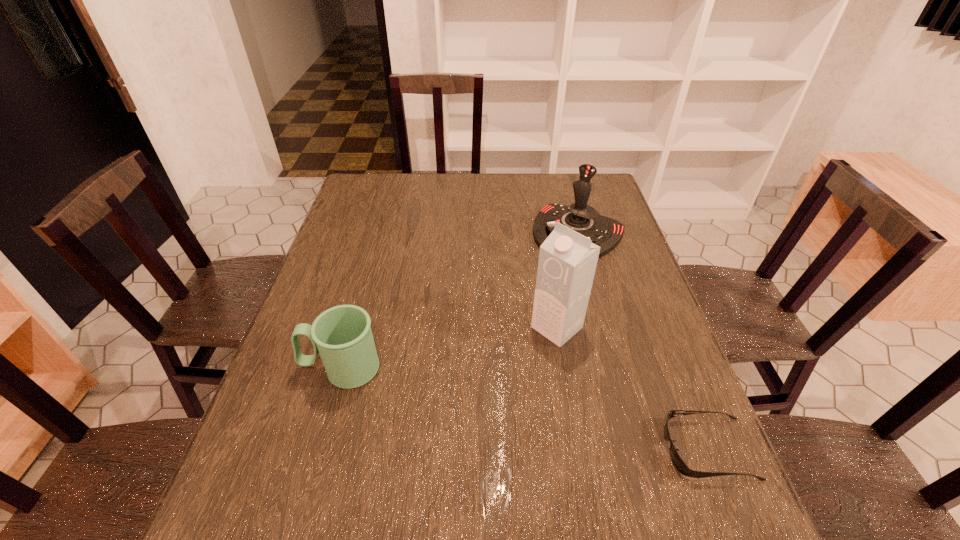
The width and height of the screenshot is (960, 540). Identify the location of sunglasses situated at the right edge. (681, 466).

At what (x,y) coordinates should I click in order to perform the action: click on joystick situated at the right edge. Please return your answer as a coordinate pair (x, y). The image size is (960, 540). Looking at the image, I should click on (605, 232).

Image resolution: width=960 pixels, height=540 pixels. I want to click on object that is at the far right corner, so click(605, 232).

I want to click on object located at the near right corner, so click(681, 466).

Image resolution: width=960 pixels, height=540 pixels. In order to click on blank space at the far edge of the desktop in this screenshot , I will do click(408, 178).

Locate an element on the screen. vacant space at the near edge of the desktop is located at coordinates (551, 480).

Locate an element on the screen. The height and width of the screenshot is (540, 960). vacant space at the left edge of the desktop is located at coordinates (327, 415).

This screenshot has width=960, height=540. I want to click on vacant space at the right edge, so click(597, 273).

Locate an element on the screen. Image resolution: width=960 pixels, height=540 pixels. vacant space at the far left corner is located at coordinates (381, 192).

Find the location of a particular element. vacant space at the far right corner of the desktop is located at coordinates [578, 174].